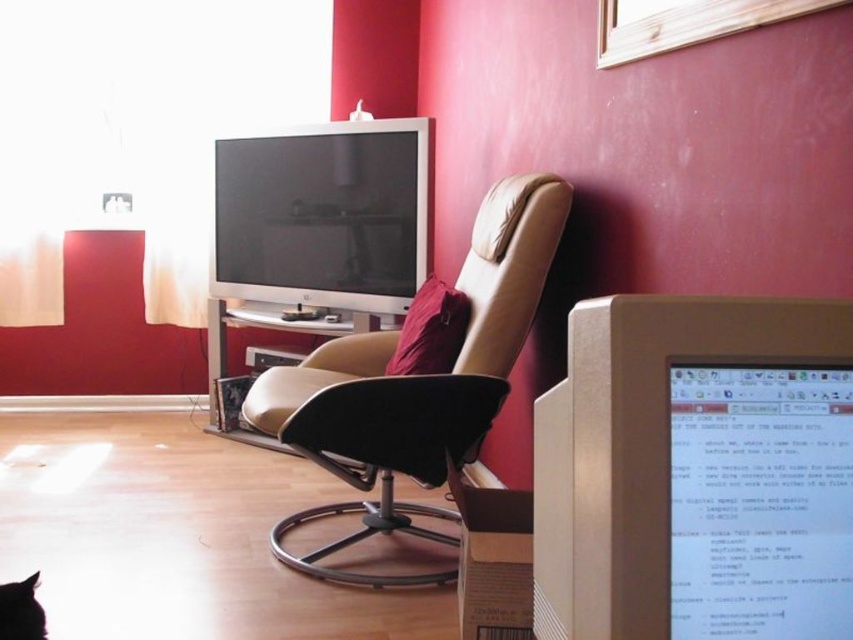
Question: Can you confirm if matte gray monitor at right is bigger than matte black monitor at upper center?

Choices:
 (A) no
 (B) yes

Answer: (A)

Question: Does matte black monitor at upper center have a greater width compared to black fur cat at lower left?

Choices:
 (A) no
 (B) yes

Answer: (B)

Question: Is matte gray monitor at right positioned behind black fur cat at lower left?

Choices:
 (A) no
 (B) yes

Answer: (A)

Question: Which point is closer to the camera taking this photo?

Choices:
 (A) (757, 435)
 (B) (35, 579)
 (C) (303, 172)
 (D) (335, 381)

Answer: (A)

Question: Based on their relative distances, which object is nearer to the matte gray monitor at right?

Choices:
 (A) matte black monitor at upper center
 (B) black fur cat at lower left

Answer: (B)

Question: Which of these objects is positioned closest to the matte white computer desk at center?

Choices:
 (A) black fur cat at lower left
 (B) matte gray monitor at right

Answer: (A)